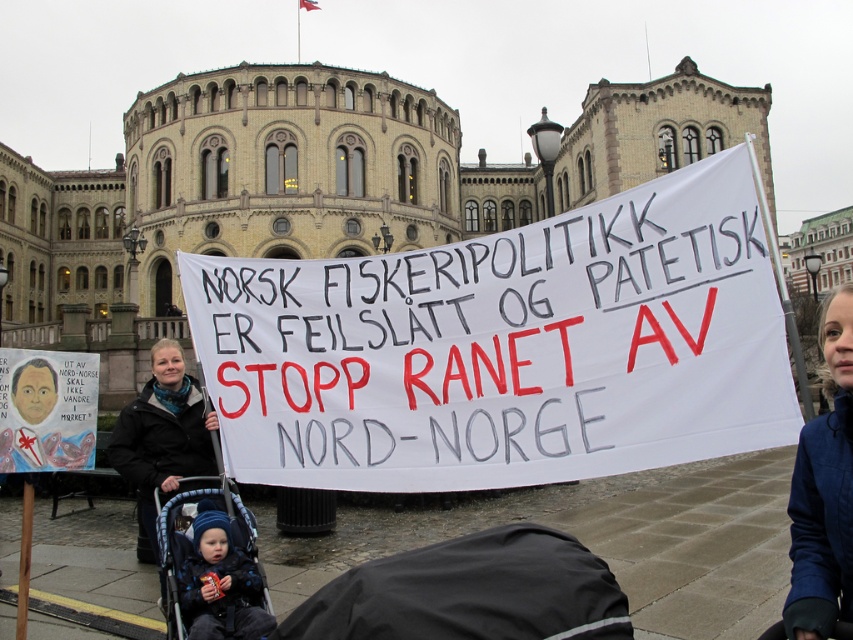
Based on the photo, who is shorter, white paper banner at center or blue fleece jacket at lower right?

Standing shorter between the two is blue fleece jacket at lower right.

Who is more forward, (405, 490) or (822, 349)?

Positioned in front is point (822, 349).

Locate an element on the screen. The image size is (853, 640). white paper banner at center is located at coordinates (x=508, y=348).

Between white paper banner at center and black jacket at center, which one has more height?

white paper banner at center

Which of these two, white paper banner at center or black jacket at center, stands shorter?

black jacket at center is shorter.

Between point (749, 184) and point (144, 406), which one is positioned in front?

Point (749, 184) is more forward.

Locate an element on the screen. The image size is (853, 640). white paper banner at center is located at coordinates (508, 348).

Is black jacket at center to the left of blue fleece hat at lower left from the viewer's perspective?

Yes, black jacket at center is to the left of blue fleece hat at lower left.

What do you see at coordinates (161, 436) in the screenshot? I see `black jacket at center` at bounding box center [161, 436].

The width and height of the screenshot is (853, 640). What do you see at coordinates (161, 436) in the screenshot? I see `black jacket at center` at bounding box center [161, 436].

Identify the location of black jacket at center. The image size is (853, 640). (161, 436).